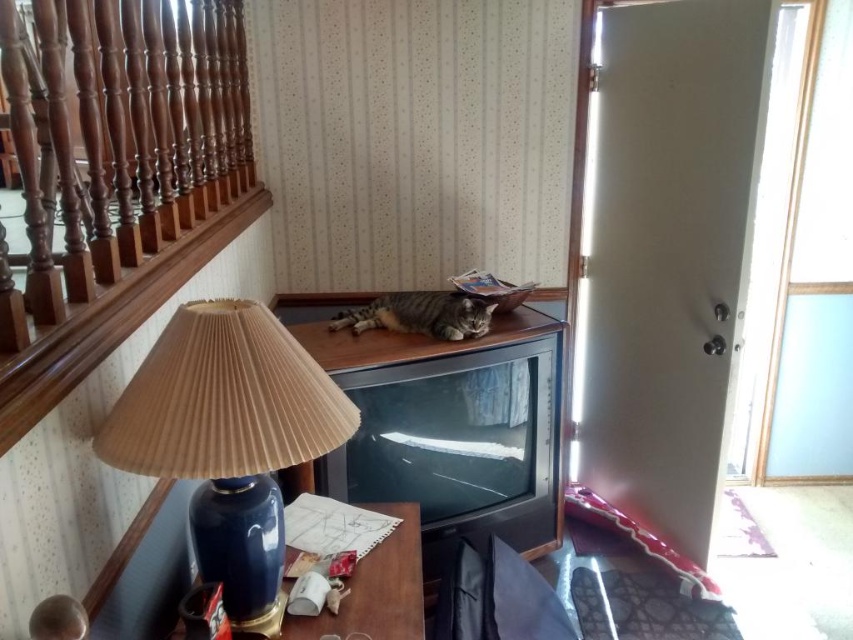
Consider the image. Measure the distance from brown wood railing at upper left to blue ceramic lampshade at upper left.

A distance of 14.84 inches exists between brown wood railing at upper left and blue ceramic lampshade at upper left.

Based on the photo, can you confirm if brown wood railing at upper left is positioned to the left of blue ceramic lampshade at upper left?

Indeed, brown wood railing at upper left is positioned on the left side of blue ceramic lampshade at upper left.

Does point (115, 16) lie behind point (210, 408)?

Yes.

I want to click on brown wood railing at upper left, so click(120, 177).

Does blue ceramic lampshade at upper left lie in front of blue glossy vase at lower left?

Yes, it is in front of blue glossy vase at lower left.

Is blue ceramic lampshade at upper left thinner than blue glossy vase at lower left?

Correct, blue ceramic lampshade at upper left's width is less than blue glossy vase at lower left's.

This screenshot has height=640, width=853. I want to click on blue ceramic lampshade at upper left, so click(224, 397).

Where is `blue ceramic lampshade at upper left`? This screenshot has height=640, width=853. blue ceramic lampshade at upper left is located at coordinates (224, 397).

Is brown wood railing at upper left further to the viewer compared to blue glossy vase at lower left?

No, brown wood railing at upper left is closer to the viewer.

This screenshot has width=853, height=640. What are the coordinates of `brown wood railing at upper left` in the screenshot? It's located at (120, 177).

The image size is (853, 640). I want to click on brown wood railing at upper left, so click(120, 177).